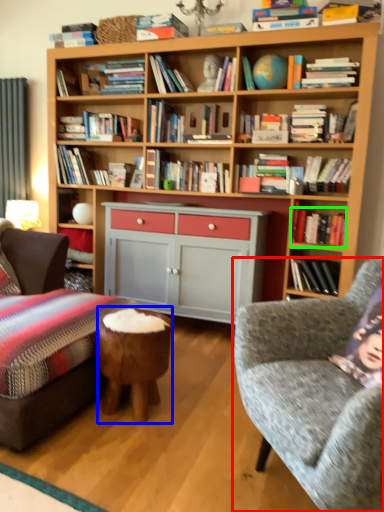
Question: Estimate the real-world distances between objects in this image. Which object is farther from studio couch (highlighted by a red box), stool (highlighted by a blue box) or book (highlighted by a green box)?

Choices:
 (A) stool
 (B) book

Answer: (B)